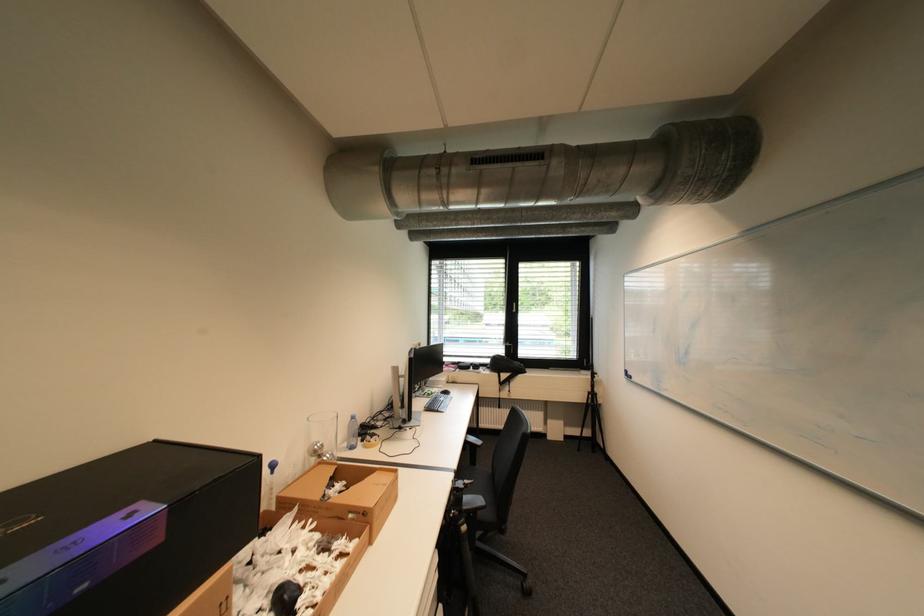
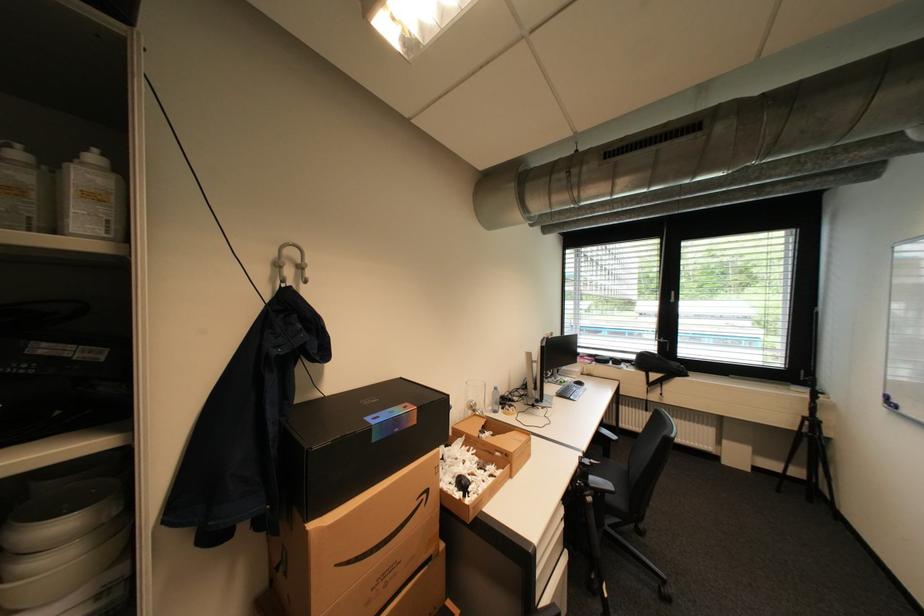
The point at (324, 445) is marked in the first image. Where is the corresponding point in the second image?

(480, 402)